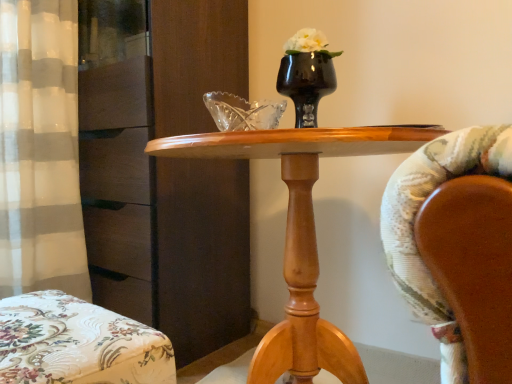
Where is `floral fabric ottoman at lower left`? This screenshot has width=512, height=384. floral fabric ottoman at lower left is located at coordinates (78, 343).

How different are the orientations of matte brown dresser at left and floral fabric ottoman at lower left in degrees?

177 degrees separate the facing orientations of matte brown dresser at left and floral fabric ottoman at lower left.

Does matte brown dresser at left have a lesser height compared to floral fabric ottoman at lower left?

No.

From a real-world perspective, is matte brown dresser at left above or below floral fabric ottoman at lower left?

matte brown dresser at left is situated higher than floral fabric ottoman at lower left in the real world.

Between matte brown dresser at left and wooden table at center, which one has smaller width?

matte brown dresser at left.

Would you say matte brown dresser at left is outside wooden table at center?

Yes, matte brown dresser at left is outside of wooden table at center.

Is matte brown dresser at left shorter than wooden table at center?

No, matte brown dresser at left is not shorter than wooden table at center.

Between matte brown dresser at left and wooden table at center, which one is positioned in front?

wooden table at center is closer to the camera.

From a real-world perspective, is floral fabric ottoman at lower left positioned above or below black glossy vase at center?

Answer: floral fabric ottoman at lower left is situated lower than black glossy vase at center in the real world.

Between floral fabric ottoman at lower left and black glossy vase at center, which one has less height?

floral fabric ottoman at lower left is shorter.

Looking at this image, considering the positions of objects floral fabric ottoman at lower left and black glossy vase at center in the image provided, who is behind, floral fabric ottoman at lower left or black glossy vase at center?

black glossy vase at center is more distant.

How many degrees apart are the facing directions of floral fabric ottoman at lower left and black glossy vase at center?

179 degrees.

Which object is positioned more to the left, wooden table at center or matte brown dresser at left?

matte brown dresser at left is more to the left.

Measure the distance from wooden table at center to matte brown dresser at left.

They are 20.84 inches apart.

From the image's perspective, is wooden table at center on matte brown dresser at left?

No, from the image's perspective, wooden table at center is not above matte brown dresser at left.

Is wooden table at center surrounding matte brown dresser at left?

No, matte brown dresser at left is not surrounded by wooden table at center.

Between point (301, 116) and point (105, 329), which one is positioned behind?

Point (301, 116)

Can we say black glossy vase at center lies outside floral fabric ottoman at lower left?

Yes, black glossy vase at center is outside of floral fabric ottoman at lower left.

Is black glossy vase at center far from floral fabric ottoman at lower left?

No, there isn't a large distance between black glossy vase at center and floral fabric ottoman at lower left.

Between black glossy vase at center and floral fabric ottoman at lower left, which one appears on the left side from the viewer's perspective?

From the viewer's perspective, floral fabric ottoman at lower left appears more on the left side.

Is wooden table at center completely or partially inside floral fabric ottoman at lower left?

No, wooden table at center is not surrounded by floral fabric ottoman at lower left.

The width and height of the screenshot is (512, 384). In the image, there is a floral fabric ottoman at lower left. Find the location of `desk above it (from the image's perspective)`. desk above it (from the image's perspective) is located at coordinates (300, 234).

Is floral fabric ottoman at lower left not near wooden table at center?

No, floral fabric ottoman at lower left is in close proximity to wooden table at center.

Is floral fabric ottoman at lower left oriented away from wooden table at center?

floral fabric ottoman at lower left is not turned away from wooden table at center.

Looking at this image, is matte brown dresser at left inside black glossy vase at center?

No, matte brown dresser at left is located outside of black glossy vase at center.

Is black glossy vase at center oriented towards matte brown dresser at left?

No, black glossy vase at center is not oriented towards matte brown dresser at left.

In terms of height, does black glossy vase at center look taller or shorter compared to matte brown dresser at left?

Clearly, black glossy vase at center is shorter compared to matte brown dresser at left.

Does black glossy vase at center have a greater width compared to matte brown dresser at left?

Incorrect, the width of black glossy vase at center does not surpass that of matte brown dresser at left.

This screenshot has height=384, width=512. Identify the location of chair below the matte brown dresser at left (from the image's perspective). (78, 343).

Find the location of `desk directly beneath the matte brown dresser at left (from a real-world perspective)`. desk directly beneath the matte brown dresser at left (from a real-world perspective) is located at coordinates point(300,234).

From the picture: Looking at the image, which one is located further to floral fabric ottoman at lower left, wooden table at center or matte brown dresser at left?

Among the two, matte brown dresser at left is located further to floral fabric ottoman at lower left.

When comparing their distances from black glossy vase at center, does matte brown dresser at left or floral fabric ottoman at lower left seem further?

Based on the image, floral fabric ottoman at lower left appears to be further to black glossy vase at center.

Looking at this image, estimate the real-world distances between objects in this image. Which object is closer to matte brown dresser at left, black glossy vase at center or floral fabric ottoman at lower left?

black glossy vase at center.

From the picture: From the image, which object appears to be farther from wooden table at center, floral fabric ottoman at lower left or matte brown dresser at left?

The object further to wooden table at center is matte brown dresser at left.

Estimate the real-world distances between objects in this image. Which object is closer to floral fabric ottoman at lower left, black glossy vase at center or wooden table at center?

wooden table at center lies closer to floral fabric ottoman at lower left than the other object.

When comparing their distances from wooden table at center, does black glossy vase at center or matte brown dresser at left seem closer?

The object closer to wooden table at center is black glossy vase at center.

Considering their positions, is wooden table at center positioned closer to matte brown dresser at left than floral fabric ottoman at lower left?

wooden table at center.

Which object lies further to the anchor point wooden table at center, floral fabric ottoman at lower left or black glossy vase at center?

The object further to wooden table at center is black glossy vase at center.

Where is `vase between floral fabric ottoman at lower left and matte brown dresser at left in the front-back direction`? The height and width of the screenshot is (384, 512). vase between floral fabric ottoman at lower left and matte brown dresser at left in the front-back direction is located at coordinates (306, 83).

I want to click on desk between floral fabric ottoman at lower left and matte brown dresser at left along the z-axis, so click(x=300, y=234).

At what (x,y) coordinates should I click in order to perform the action: click on desk between black glossy vase at center and floral fabric ottoman at lower left from top to bottom. Please return your answer as a coordinate pair (x, y). The height and width of the screenshot is (384, 512). Looking at the image, I should click on (300, 234).

This screenshot has width=512, height=384. I want to click on vase positioned between wooden table at center and matte brown dresser at left from near to far, so click(x=306, y=83).